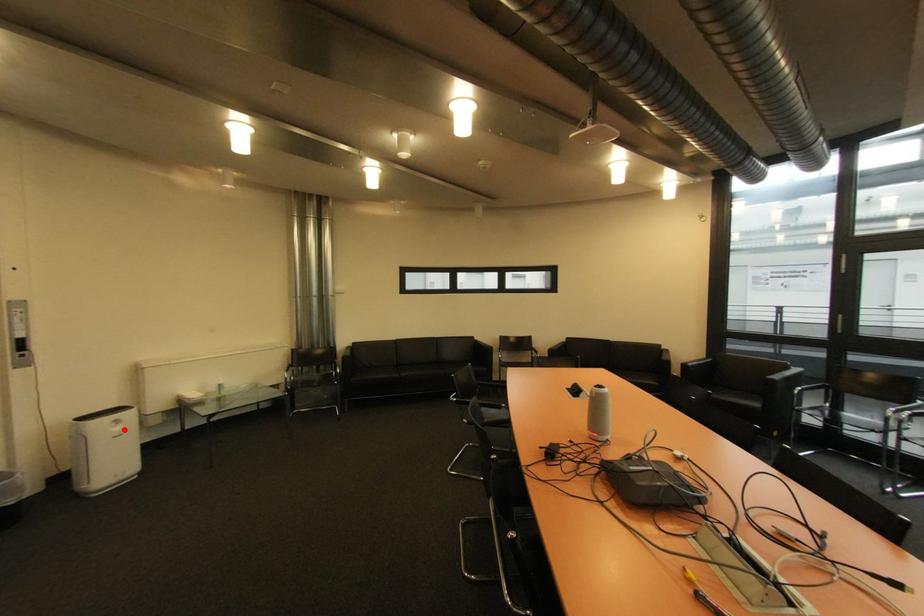
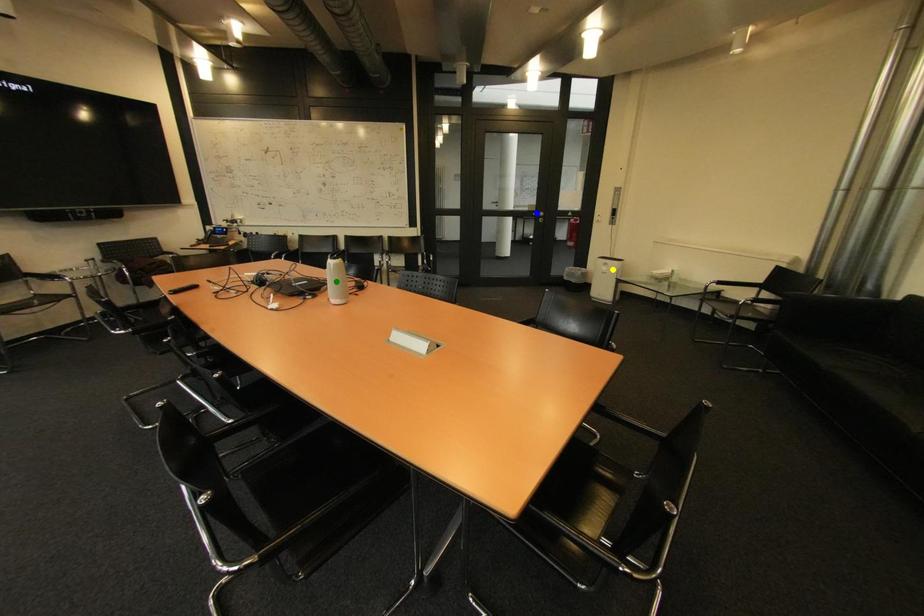
Question: I am providing you with two images of the same scene from different viewpoints. A red point is marked on the first image. You are given multiple points on the second image. In image 2, which mark is for the same physical point as the one in image 1?

Choices:
 (A) blue point
 (B) yellow point
 (C) green point

Answer: (B)